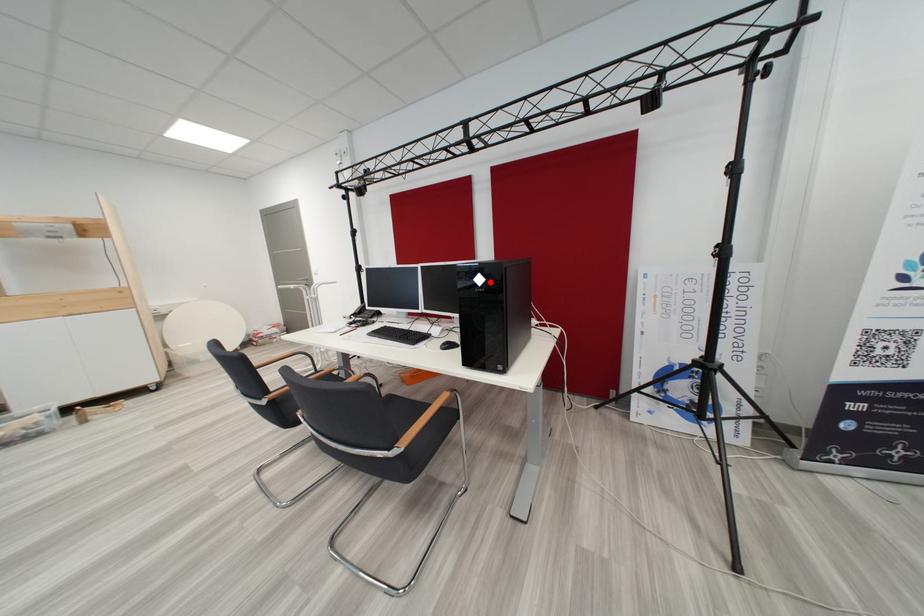
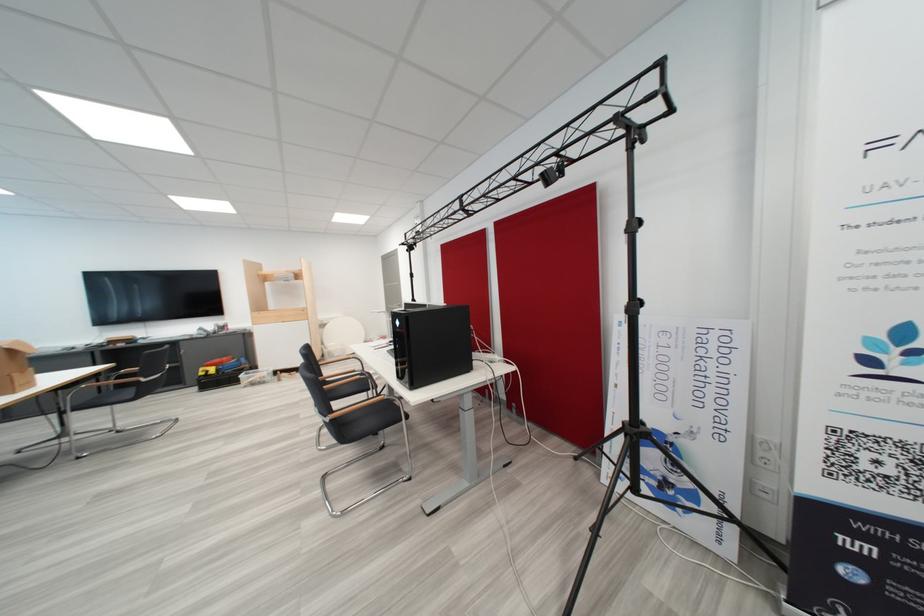
The point at the highlighted location is marked in the first image. Where is the corresponding point in the second image?

(407, 325)